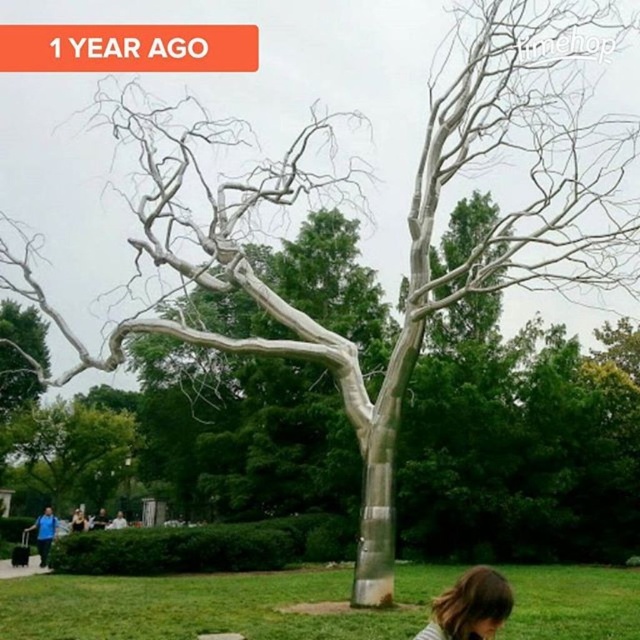
Question: Can you confirm if green grass at lower center is wider than matte black hair at lower center?

Choices:
 (A) no
 (B) yes

Answer: (B)

Question: Does brown hair at lower center appear on the left side of matte black hair at lower center?

Choices:
 (A) no
 (B) yes

Answer: (A)

Question: Which object is closer to the camera taking this photo?

Choices:
 (A) brown hair at lower center
 (B) matte black hair at lower center
 (C) silver metallic tree at center
 (D) green grass at lower center

Answer: (A)

Question: Which point appears closest to the camera in this image?

Choices:
 (A) (36, 506)
 (B) (465, 609)

Answer: (B)

Question: Which of the following is the closest to the observer?

Choices:
 (A) (248, 616)
 (B) (104, 420)

Answer: (A)

Question: Does green grass at lower center have a lesser width compared to silver metallic tree at center?

Choices:
 (A) yes
 (B) no

Answer: (B)